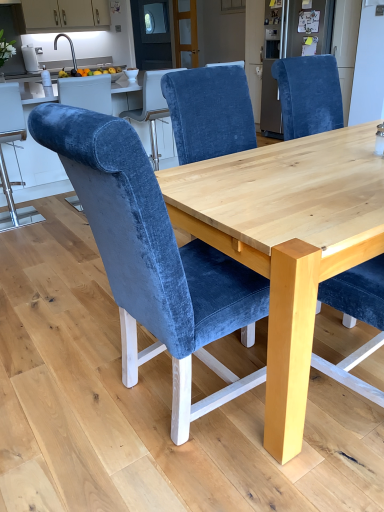
Question: Is velvet blue chair at left, which is the 1th chair in back-to-front order, taller than velvet blue chair at center, arranged as the 1th chair when viewed from the right?

Choices:
 (A) yes
 (B) no

Answer: (B)

Question: From a real-world perspective, is velvet blue chair at left, which appears as the 1th chair when viewed from the left, physically above velvet blue chair at center, the 3th chair in the left-to-right sequence?

Choices:
 (A) no
 (B) yes

Answer: (A)

Question: Is velvet blue chair at left, which is the 1th chair in back-to-front order, not inside velvet blue chair at center, the 3th chair in the left-to-right sequence?

Choices:
 (A) no
 (B) yes

Answer: (B)

Question: Is velvet blue chair at left, which ranks as the 3th chair in right-to-left order, placed right next to velvet blue chair at center, the second chair positioned from the front?

Choices:
 (A) yes
 (B) no

Answer: (B)

Question: Does velvet blue chair at left, which is the 1th chair in back-to-front order, turn towards velvet blue chair at center, the 3th chair in the left-to-right sequence?

Choices:
 (A) yes
 (B) no

Answer: (B)

Question: Can you confirm if velvet blue chair at left, acting as the third chair starting from the front, is positioned to the left of velvet blue chair at center, the 3th chair in the left-to-right sequence?

Choices:
 (A) no
 (B) yes

Answer: (B)

Question: Is velvet blue chair at center, the second chair positioned from the front, further to camera compared to velvet blue chair at left, which appears as the 1th chair when viewed from the left?

Choices:
 (A) yes
 (B) no

Answer: (B)

Question: Is velvet blue chair at center, the 3th chair in the left-to-right sequence, in front of velvet blue chair at left, which ranks as the 3th chair in right-to-left order?

Choices:
 (A) yes
 (B) no

Answer: (A)

Question: Can you see velvet blue chair at center, the second chair positioned from the front, touching velvet blue chair at left, acting as the third chair starting from the front?

Choices:
 (A) no
 (B) yes

Answer: (A)

Question: Is velvet blue chair at left, which ranks as the 3th chair in right-to-left order, at the back of velvet blue chair at center, which is the 2th chair in back-to-front order?

Choices:
 (A) no
 (B) yes

Answer: (A)

Question: Is velvet blue chair at center, which is the 2th chair in back-to-front order, positioned far away from velvet blue chair at left, which appears as the 1th chair when viewed from the left?

Choices:
 (A) no
 (B) yes

Answer: (B)

Question: From the image's perspective, is velvet blue chair at center, arranged as the 1th chair when viewed from the right, under velvet blue chair at left, which is the 1th chair in back-to-front order?

Choices:
 (A) yes
 (B) no

Answer: (A)

Question: From the image's perspective, is velvet blue chair at center, arranged as the second chair when viewed from the right, located above velvet blue chair at left, which appears as the 1th chair when viewed from the left?

Choices:
 (A) yes
 (B) no

Answer: (B)